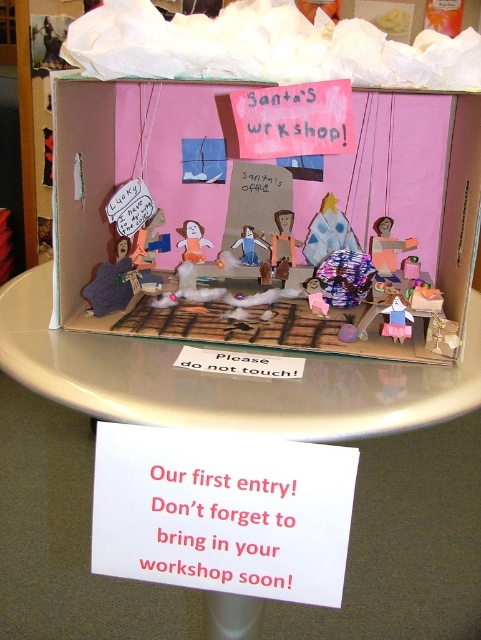
Who is more forward, (104, 426) or (381, 333)?

Point (104, 426)

Is point (112, 493) behind point (402, 337)?

No, it is not.

The image size is (481, 640). What are the coordinates of `white paper sign at lower center` in the screenshot? It's located at (223, 513).

Who is shorter, pink cardboard box at center or wooden figure at center?

wooden figure at center is shorter.

The height and width of the screenshot is (640, 481). Identify the location of pink cardboard box at center. (263, 209).

Who is more distant from viewer, (459, 240) or (291, 262)?

Positioned behind is point (291, 262).

Where is `pink cardboard box at center`? pink cardboard box at center is located at coordinates (263, 209).

Can you confirm if pink paper sign at center is shorter than matte pink fabric at center?

Yes.

Is pink paper sign at center bigger than matte pink fabric at center?

Correct, pink paper sign at center is larger in size than matte pink fabric at center.

Is point (280, 113) positioned before point (384, 244)?

Yes, point (280, 113) is closer to viewer.

Image resolution: width=481 pixels, height=640 pixels. What are the coordinates of `pink paper sign at center` in the screenshot? It's located at (293, 120).